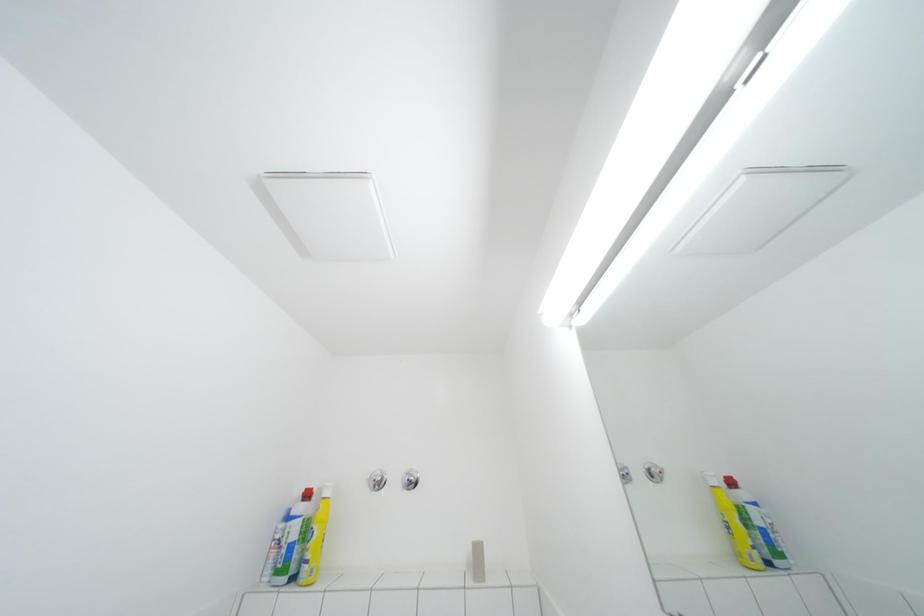
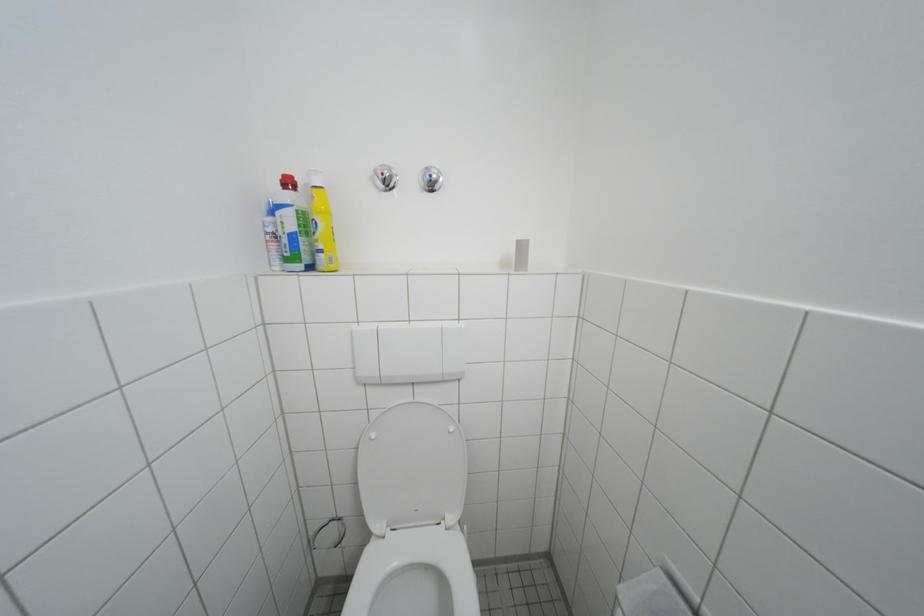
Question: Based on the continuous images, in which direction is the camera rotating? Reply with the corresponding letter.

Choices:
 (A) Left
 (B) Right
 (C) Up
 (D) Down

Answer: (D)